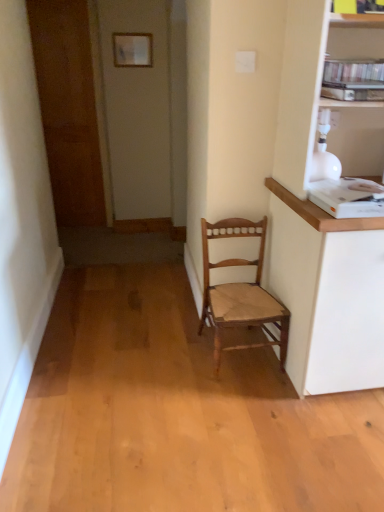
This screenshot has width=384, height=512. In order to click on vacant space to the left of wooden chair at center in this screenshot , I will do `click(177, 370)`.